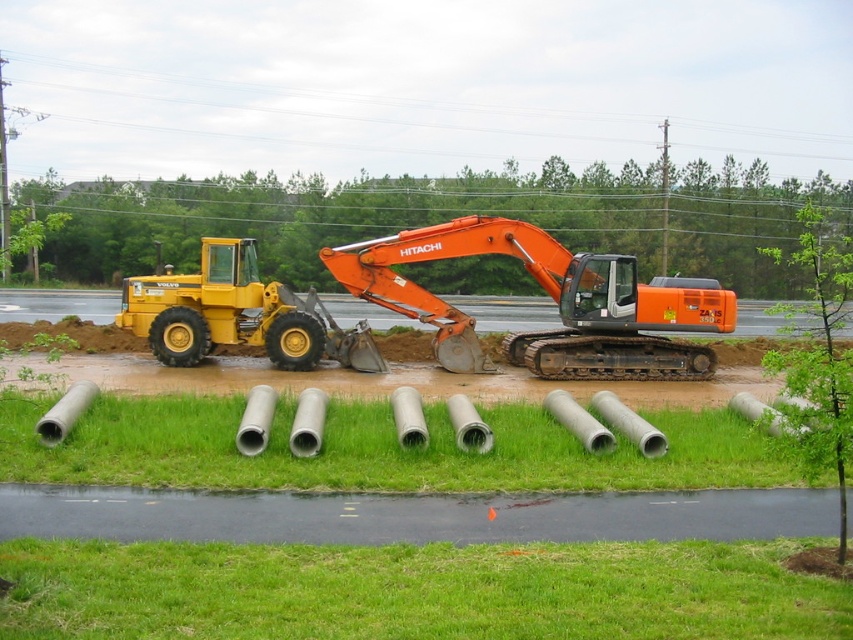
You are a worker standing at the edge of the construction site. You need to place a new safety sign on the nearest object to you between the green grass at lower center and the green concrete pipes at lower center. Which object should you choose?

The green grass at lower center is closer to the viewer than the green concrete pipes at lower center, so you should place the safety sign on the green grass at lower center.

You are standing at the point marked by the coordinates point (381, 449) in the construction scene. What object are you directly positioned on?

The point (381, 449) marks green concrete pipes at lower center, so you are directly positioned on the green concrete pipes at lower center.

You are a delivery truck driver who needs to unload a large crate that requires 10 meters of space to maneuver. You see the green concrete pipes at lower center and the orange metallic excavator at center in the construction site. Can you safely maneuver the crate between these two objects?

The green concrete pipes at lower center and orange metallic excavator at center are 9.92 meters apart from each other. Since the required space is 10 meters, the distance is insufficient, so you cannot safely maneuver the crate between them.